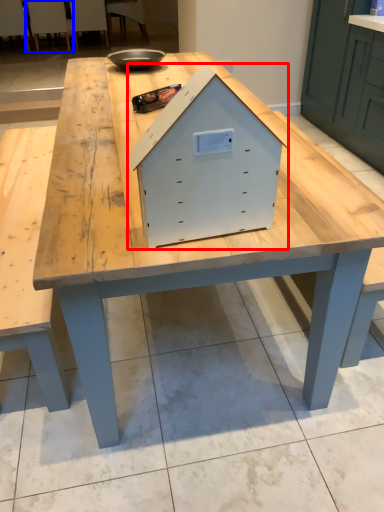
Question: Among these objects, which one is nearest to the camera, crate (highlighted by a red box) or chair (highlighted by a blue box)?

Choices:
 (A) crate
 (B) chair

Answer: (A)